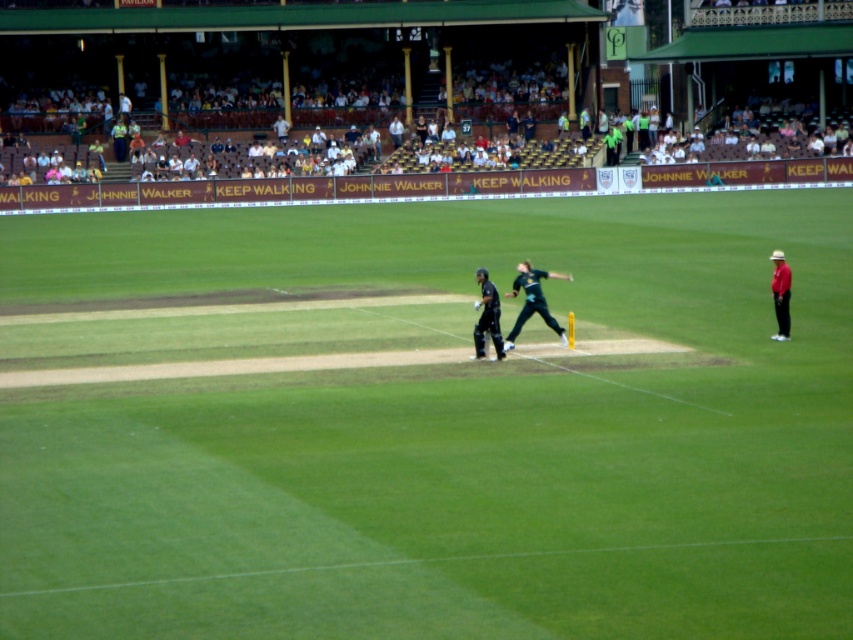
You are a photographer at the cricket match. You want to take a photo of the dark green jersey at center and the dark green uniform at center. Which one is positioned further back from the camera?

The dark green uniform at center is behind the dark green jersey at center, so the dark green uniform at center is positioned further back from the camera.

You are a spectator standing at the edge of the stadium field. You want to take a photo of the dark green jersey at center without the green grass pitch at center blocking the view. Is this possible?

The green grass pitch at center is in front of the dark green jersey at center, so taking a photo without the pitch blocking the view would require moving to a position where the jersey is not obscured by the pitch. However, since the jersey is behind the pitch from your current position, you might need to reposition yourself to capture the jersey without the pitch in front.

You are a drone operator trying to capture aerial footage of the cricket match. The green grass pitch at center and the dark green jersey at center are both in your camera frame. Which object appears taller in the frame?

The green grass pitch at center appears taller than the dark green jersey at center in the camera frame because the pitch has a greater height compared to the jersey.